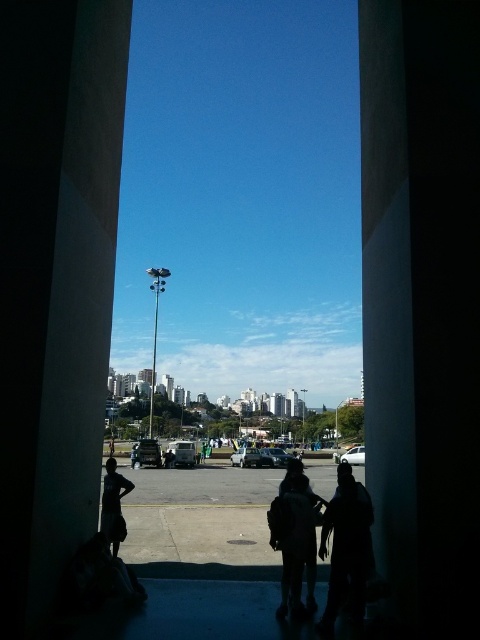
Question: Which object is closer to the camera taking this photo?

Choices:
 (A) dark textured jacket at lower center
 (B) white glossy car at center
 (C) white smooth pillar at left

Answer: (C)

Question: Which of the following is the farthest from the observer?

Choices:
 (A) (356, 445)
 (B) (116, 518)
 (C) (136, 458)

Answer: (A)

Question: Does dark gray jacket at center appear on the left side of dark gray hoodie at center?

Choices:
 (A) no
 (B) yes

Answer: (A)

Question: Can you confirm if white smooth pillar at center is thinner than white smooth pillar at left?

Choices:
 (A) yes
 (B) no

Answer: (A)

Question: Is the position of white glossy car at center more distant than that of dark clothing figure at center?

Choices:
 (A) no
 (B) yes

Answer: (A)

Question: Which is farther from the white smooth pillar at left?

Choices:
 (A) dark clothing figure at center
 (B) dark textured jacket at lower center

Answer: (A)